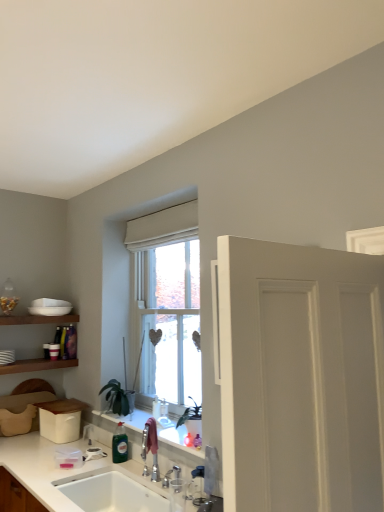
Question: From a real-world perspective, is white matte door at right located higher than green matte plant at center?

Choices:
 (A) yes
 (B) no

Answer: (A)

Question: Is white matte door at right facing towards green matte plant at center?

Choices:
 (A) yes
 (B) no

Answer: (B)

Question: From a real-world perspective, is white matte door at right beneath green matte plant at center?

Choices:
 (A) no
 (B) yes

Answer: (A)

Question: Is white matte door at right directly adjacent to green matte plant at center?

Choices:
 (A) yes
 (B) no

Answer: (B)

Question: Does white matte door at right have a lesser width compared to green matte plant at center?

Choices:
 (A) no
 (B) yes

Answer: (B)

Question: Does white matte door at right lie behind green matte plant at center?

Choices:
 (A) no
 (B) yes

Answer: (A)

Question: Is the depth of white ceramic sink at lower left greater than that of white matte door at right?

Choices:
 (A) yes
 (B) no

Answer: (A)

Question: Is white matte door at right surrounded by white ceramic sink at lower left?

Choices:
 (A) no
 (B) yes

Answer: (A)

Question: Is white ceramic sink at lower left bigger than white matte door at right?

Choices:
 (A) yes
 (B) no

Answer: (B)

Question: Does white ceramic sink at lower left touch white matte door at right?

Choices:
 (A) yes
 (B) no

Answer: (B)

Question: Can you confirm if white ceramic sink at lower left is positioned to the right of white matte door at right?

Choices:
 (A) no
 (B) yes

Answer: (A)

Question: Does white ceramic sink at lower left have a lesser height compared to white matte door at right?

Choices:
 (A) no
 (B) yes

Answer: (B)

Question: Is the depth of green glass bottle at sink greater than that of white ceramic sink at lower left?

Choices:
 (A) no
 (B) yes

Answer: (B)